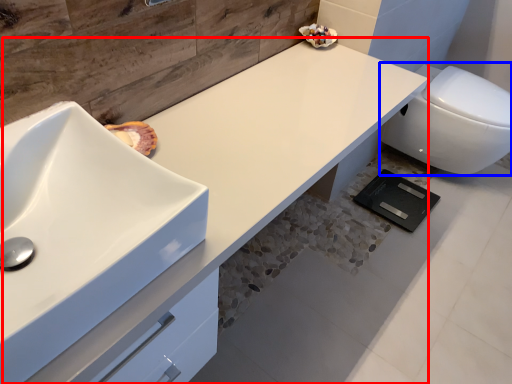
Question: Which object appears closest to the camera in this image, counter top (highlighted by a red box) or toilet (highlighted by a blue box)?

Choices:
 (A) counter top
 (B) toilet

Answer: (A)